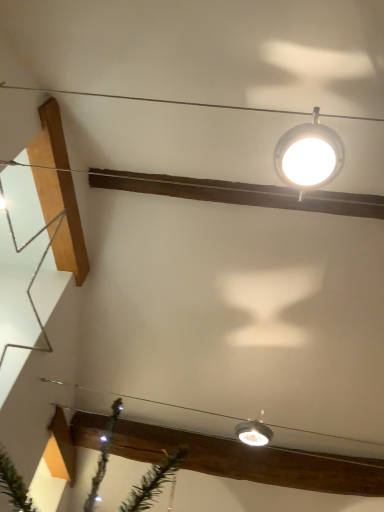
Question: Which direction should I rotate to look at matte silver lamp at lower center, which is the 1th lamp in back-to-front order, — up or down?

Choices:
 (A) up
 (B) down

Answer: (B)

Question: Is matte silver lamp at lower center, marked as the second lamp in a top-to-bottom arrangement, smaller than clear plastic wire at lower center?

Choices:
 (A) no
 (B) yes

Answer: (B)

Question: Is the position of matte silver lamp at lower center, marked as the second lamp in a top-to-bottom arrangement, less distant than that of clear plastic wire at lower center?

Choices:
 (A) no
 (B) yes

Answer: (A)

Question: Is matte silver lamp at lower center, which is the 1th lamp in back-to-front order, outside of clear plastic wire at lower center?

Choices:
 (A) yes
 (B) no

Answer: (B)

Question: Can you confirm if matte silver lamp at lower center, marked as the second lamp in a top-to-bottom arrangement, is bigger than clear plastic wire at lower center?

Choices:
 (A) no
 (B) yes

Answer: (A)

Question: Is matte silver lamp at lower center, marked as the second lamp in a top-to-bottom arrangement, directly adjacent to clear plastic wire at lower center?

Choices:
 (A) yes
 (B) no

Answer: (B)

Question: Considering the relative positions of matte silver lamp at lower center, which ranks as the 1th lamp in bottom-to-top order, and clear plastic wire at lower center in the image provided, is matte silver lamp at lower center, which ranks as the 1th lamp in bottom-to-top order, to the left of clear plastic wire at lower center from the viewer's perspective?

Choices:
 (A) no
 (B) yes

Answer: (A)

Question: Can you confirm if metallic silver star at left is shorter than matte silver lamp at lower center, which is the 1th lamp in back-to-front order?

Choices:
 (A) no
 (B) yes

Answer: (A)

Question: Considering the relative sizes of metallic silver star at left and matte silver lamp at lower center, which ranks as the 1th lamp in bottom-to-top order, in the image provided, is metallic silver star at left taller than matte silver lamp at lower center, which ranks as the 1th lamp in bottom-to-top order,?

Choices:
 (A) yes
 (B) no

Answer: (A)

Question: From a real-world perspective, is metallic silver star at left physically below matte silver lamp at lower center, which ranks as the 1th lamp in bottom-to-top order?

Choices:
 (A) yes
 (B) no

Answer: (B)

Question: Is metallic silver star at left thinner than matte silver lamp at lower center, which ranks as the 1th lamp in bottom-to-top order?

Choices:
 (A) yes
 (B) no

Answer: (A)

Question: Can we say metallic silver star at left lies outside matte silver lamp at lower center, which ranks as the second lamp in front-to-back order?

Choices:
 (A) no
 (B) yes

Answer: (B)

Question: Does metallic silver star at left turn towards matte silver lamp at lower center, which ranks as the second lamp in front-to-back order?

Choices:
 (A) yes
 (B) no

Answer: (A)

Question: Can you see matte silver lamp at lower center, which ranks as the second lamp in front-to-back order, touching metallic silver star at left?

Choices:
 (A) no
 (B) yes

Answer: (A)